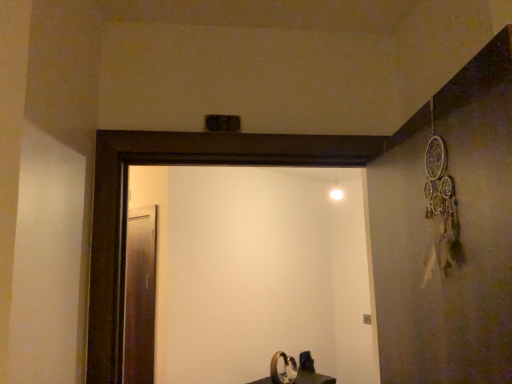
What is the approximate height of transparent glass screen door at left, which appears as the first screen door when viewed from the back?

4.22 feet.

You are a GUI agent. You are given a task and a screenshot of the screen. Output one action in this format:
    pyautogui.click(x=<x>, y=<y>)
    Task: Click on the white glossy screen door at center, positioned as the 1th screen door in front-to-back order
    The width and height of the screenshot is (512, 384).
    Given the screenshot: What is the action you would take?
    pyautogui.click(x=257, y=271)

What do you see at coordinates (257, 271) in the screenshot?
I see `white glossy screen door at center, which is the second screen door in left-to-right order` at bounding box center [257, 271].

Where is `transparent glass screen door at left, which is counted as the second screen door, starting from the front`? transparent glass screen door at left, which is counted as the second screen door, starting from the front is located at coordinates (140, 296).

Considering the relative positions of white glossy screen door at center, positioned as the 1th screen door in front-to-back order, and transparent glass screen door at left, which appears as the first screen door when viewed from the back, in the image provided, is white glossy screen door at center, positioned as the 1th screen door in front-to-back order, behind transparent glass screen door at left, which appears as the first screen door when viewed from the back,?

No, white glossy screen door at center, positioned as the 1th screen door in front-to-back order, is closer to the viewer.

Is white glossy screen door at center, which is the 1th screen door from right to left, located outside transparent glass screen door at left, the second screen door in the right-to-left sequence?

Yes.

Can you confirm if white glossy screen door at center, acting as the second screen door starting from the back, is positioned to the right of transparent glass screen door at left, which is counted as the second screen door, starting from the front?

Indeed, white glossy screen door at center, acting as the second screen door starting from the back, is positioned on the right side of transparent glass screen door at left, which is counted as the second screen door, starting from the front.

Considering the relative sizes of white glossy screen door at center, which is the second screen door in left-to-right order, and transparent glass screen door at left, which appears as the first screen door when viewed from the back, in the image provided, is white glossy screen door at center, which is the second screen door in left-to-right order, shorter than transparent glass screen door at left, which appears as the first screen door when viewed from the back,?

Indeed, white glossy screen door at center, which is the second screen door in left-to-right order, has a lesser height compared to transparent glass screen door at left, which appears as the first screen door when viewed from the back.

From the image's perspective, between matte black sink at lower center and white glossy screen door at center, which is the second screen door in left-to-right order, who is located below?

matte black sink at lower center.

From their relative heights in the image, would you say matte black sink at lower center is taller or shorter than white glossy screen door at center, acting as the second screen door starting from the back?

In the image, matte black sink at lower center appears to be shorter than white glossy screen door at center, acting as the second screen door starting from the back.

In the image, is matte black sink at lower center on the left side or the right side of white glossy screen door at center, positioned as the 1th screen door in front-to-back order?

Clearly, matte black sink at lower center is on the right of white glossy screen door at center, positioned as the 1th screen door in front-to-back order, in the image.

Who is more distant, matte black sink at lower center or white glossy screen door at center, which is the second screen door in left-to-right order?

matte black sink at lower center is further from the camera.

Is transparent glass screen door at left, the second screen door in the right-to-left sequence, facing away from white glossy screen door at center, positioned as the 1th screen door in front-to-back order?

No, transparent glass screen door at left, the second screen door in the right-to-left sequence, is not facing the opposite direction of white glossy screen door at center, positioned as the 1th screen door in front-to-back order.

Can white glossy screen door at center, positioned as the 1th screen door in front-to-back order, be found inside transparent glass screen door at left, the second screen door in the right-to-left sequence?

Actually, white glossy screen door at center, positioned as the 1th screen door in front-to-back order, is outside transparent glass screen door at left, the second screen door in the right-to-left sequence.

Can you tell me how much transparent glass screen door at left, positioned as the first screen door in left-to-right order, and white glossy screen door at center, which is the 1th screen door from right to left, differ in facing direction?

There is a 50.4-degree angle between the facing directions of transparent glass screen door at left, positioned as the first screen door in left-to-right order, and white glossy screen door at center, which is the 1th screen door from right to left.

Is transparent glass screen door at left, which is counted as the second screen door, starting from the front, smaller than white glossy screen door at center, which is the 1th screen door from right to left?

Indeed, transparent glass screen door at left, which is counted as the second screen door, starting from the front, has a smaller size compared to white glossy screen door at center, which is the 1th screen door from right to left.

From the image's perspective, which one is positioned lower, matte black sink at lower center or transparent glass screen door at left, the second screen door in the right-to-left sequence?

matte black sink at lower center is shown below in the image.

Would you consider matte black sink at lower center to be distant from transparent glass screen door at left, which is counted as the second screen door, starting from the front?

matte black sink at lower center is far away from transparent glass screen door at left, which is counted as the second screen door, starting from the front.

Relative to transparent glass screen door at left, the second screen door in the right-to-left sequence, is matte black sink at lower center in front or behind?

matte black sink at lower center is in front of transparent glass screen door at left, the second screen door in the right-to-left sequence.

Between matte black sink at lower center and transparent glass screen door at left, which is counted as the second screen door, starting from the front, which one appears on the left side from the viewer's perspective?

Positioned to the left is transparent glass screen door at left, which is counted as the second screen door, starting from the front.

Is point (134, 231) positioned in front of point (277, 358)?

Yes, point (134, 231) is closer to viewer.

Find the location of `screen door that is the 2nd object to the left of the matte black sink at lower center, starting at the anchor`. screen door that is the 2nd object to the left of the matte black sink at lower center, starting at the anchor is located at coordinates (140, 296).

What's the angular difference between white glossy screen door at center, which is the second screen door in left-to-right order, and matte black sink at lower center's facing directions?

The angular difference between white glossy screen door at center, which is the second screen door in left-to-right order, and matte black sink at lower center is 38.2 degrees.

Considering the relative sizes of white glossy screen door at center, positioned as the 1th screen door in front-to-back order, and matte black sink at lower center in the image provided, is white glossy screen door at center, positioned as the 1th screen door in front-to-back order, smaller than matte black sink at lower center?

Actually, white glossy screen door at center, positioned as the 1th screen door in front-to-back order, might be larger than matte black sink at lower center.

Are white glossy screen door at center, acting as the second screen door starting from the back, and matte black sink at lower center located far from each other?

No.

Find the location of a particular element. This screenshot has height=384, width=512. sink lying behind the white glossy screen door at center, positioned as the 1th screen door in front-to-back order is located at coordinates (294, 371).

In order to click on screen door in front of the transparent glass screen door at left, positioned as the first screen door in left-to-right order in this screenshot , I will do `click(257, 271)`.

Identify the location of the 2nd screen door above when counting from the matte black sink at lower center (from the image's perspective). (257, 271).

Which object lies nearer to the anchor point transparent glass screen door at left, which appears as the first screen door when viewed from the back, white glossy screen door at center, acting as the second screen door starting from the back, or matte black sink at lower center?

white glossy screen door at center, acting as the second screen door starting from the back, lies closer to transparent glass screen door at left, which appears as the first screen door when viewed from the back, than the other object.

When comparing their distances from matte black sink at lower center, does transparent glass screen door at left, which appears as the first screen door when viewed from the back, or white glossy screen door at center, which is the 1th screen door from right to left, seem further?

transparent glass screen door at left, which appears as the first screen door when viewed from the back, is positioned further to the anchor matte black sink at lower center.

Looking at the image, which one is located further to matte black sink at lower center, white glossy screen door at center, which is the second screen door in left-to-right order, or transparent glass screen door at left, which appears as the first screen door when viewed from the back?

transparent glass screen door at left, which appears as the first screen door when viewed from the back, is positioned further to the anchor matte black sink at lower center.

Estimate the real-world distances between objects in this image. Which object is further from transparent glass screen door at left, positioned as the first screen door in left-to-right order, matte black sink at lower center or white glossy screen door at center, which is the 1th screen door from right to left?

matte black sink at lower center is positioned further to the anchor transparent glass screen door at left, positioned as the first screen door in left-to-right order.

Estimate the real-world distances between objects in this image. Which object is further from white glossy screen door at center, positioned as the 1th screen door in front-to-back order, transparent glass screen door at left, which appears as the first screen door when viewed from the back, or matte black sink at lower center?

Based on the image, transparent glass screen door at left, which appears as the first screen door when viewed from the back, appears to be further to white glossy screen door at center, positioned as the 1th screen door in front-to-back order.

Estimate the real-world distances between objects in this image. Which object is closer to white glossy screen door at center, positioned as the 1th screen door in front-to-back order, matte black sink at lower center or transparent glass screen door at left, positioned as the first screen door in left-to-right order?

matte black sink at lower center.

The height and width of the screenshot is (384, 512). What are the coordinates of `sink located between white glossy screen door at center, which is the 1th screen door from right to left, and transparent glass screen door at left, positioned as the first screen door in left-to-right order, in the depth direction` in the screenshot? It's located at (294, 371).